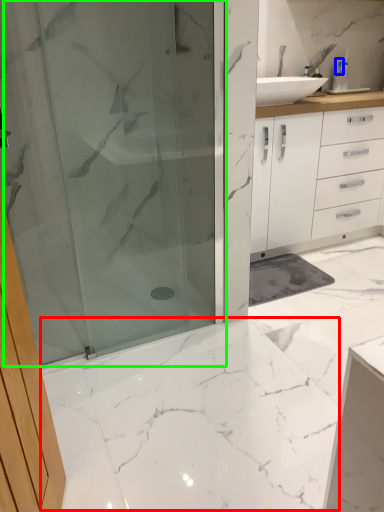
Question: Estimate the real-world distances between objects in this image. Which object is closer to marble (highlighted by a red box), toiletry (highlighted by a blue box) or shower door (highlighted by a green box)?

Choices:
 (A) toiletry
 (B) shower door

Answer: (B)